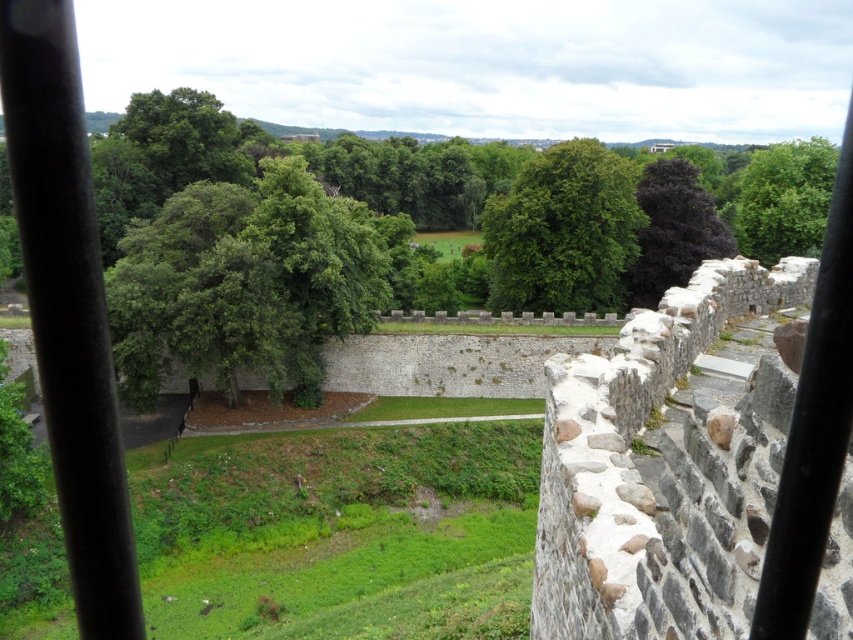
Question: Which object is positioned farthest from the green leafy tree at center?

Choices:
 (A) green leafy tree at upper right
 (B) dark purple leafy tree at upper right

Answer: (A)

Question: Which object appears closest to the camera in this image?

Choices:
 (A) green leafy tree at upper right
 (B) dark purple leafy tree at upper right

Answer: (B)

Question: Is green leafy tree at center to the left of dark purple leafy tree at upper right from the viewer's perspective?

Choices:
 (A) yes
 (B) no

Answer: (A)

Question: Which point is closer to the camera?

Choices:
 (A) (764, 195)
 (B) (578, 227)
 (C) (709, 225)

Answer: (B)

Question: Observing the image, what is the correct spatial positioning of green leafy tree at center in reference to green leafy tree at upper right?

Choices:
 (A) left
 (B) right

Answer: (A)

Question: Can you confirm if green leafy tree at center is bigger than green leafy tree at upper right?

Choices:
 (A) no
 (B) yes

Answer: (A)